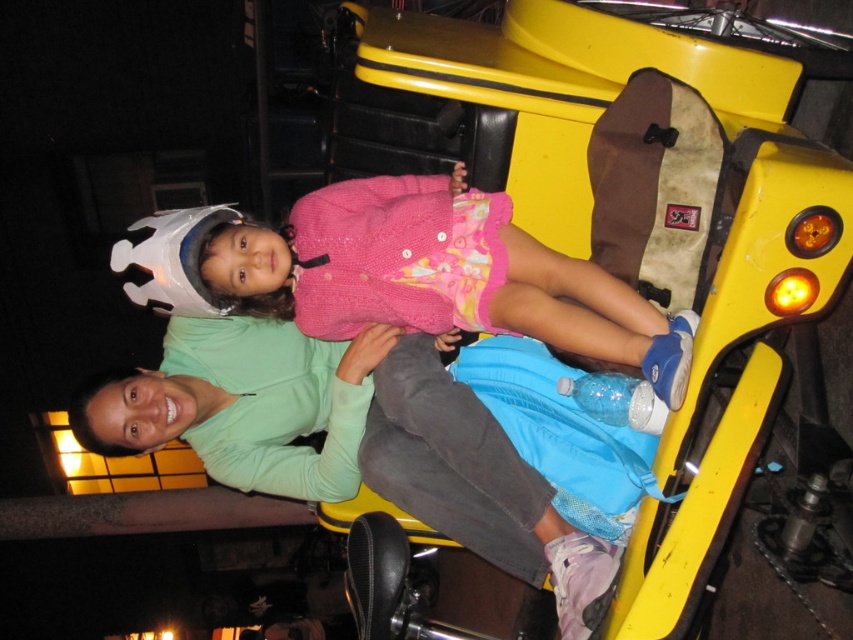
Does green matte jacket at center lie behind pink knitted sweater at center?

Yes.

This screenshot has height=640, width=853. Describe the element at coordinates (350, 440) in the screenshot. I see `green matte jacket at center` at that location.

Who is more distant from viewer, (428, 474) or (349, 214)?

The point (428, 474) is more distant.

I want to click on green matte jacket at center, so click(350, 440).